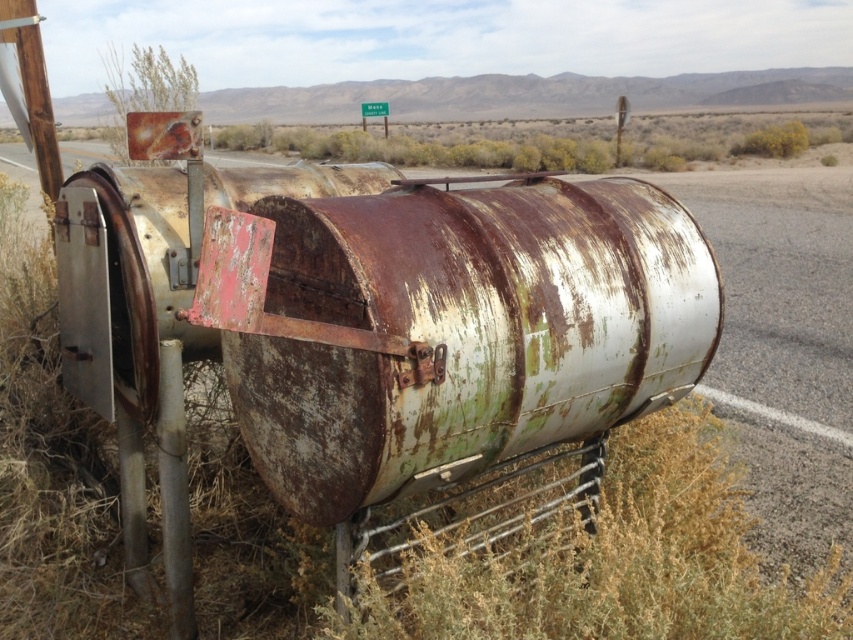
You are standing in front of the weathered cylindrical metal structure in the desert. You notice the green matte weed at lower right and the rusty metal pole at lower left. Which object is closer to you?

The green matte weed at lower right is closer to you because it is in front of the rusty metal pole at lower left.